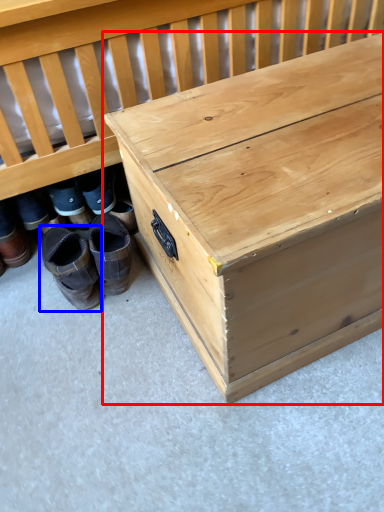
Question: Which object is further to the camera taking this photo, table (highlighted by a red box) or footwear (highlighted by a blue box)?

Choices:
 (A) table
 (B) footwear

Answer: (B)